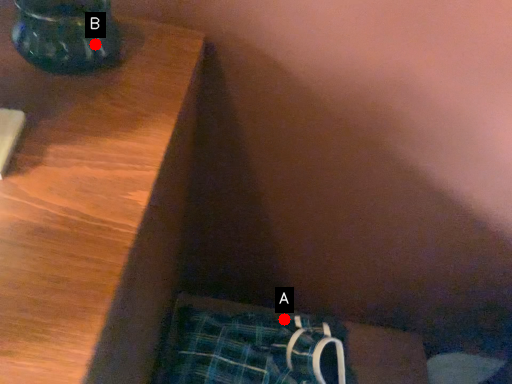
Question: Two points are circled on the image, labeled by A and B beside each circle. Which of the following is the farthest from the observer?

Choices:
 (A) A is further
 (B) B is further

Answer: (A)